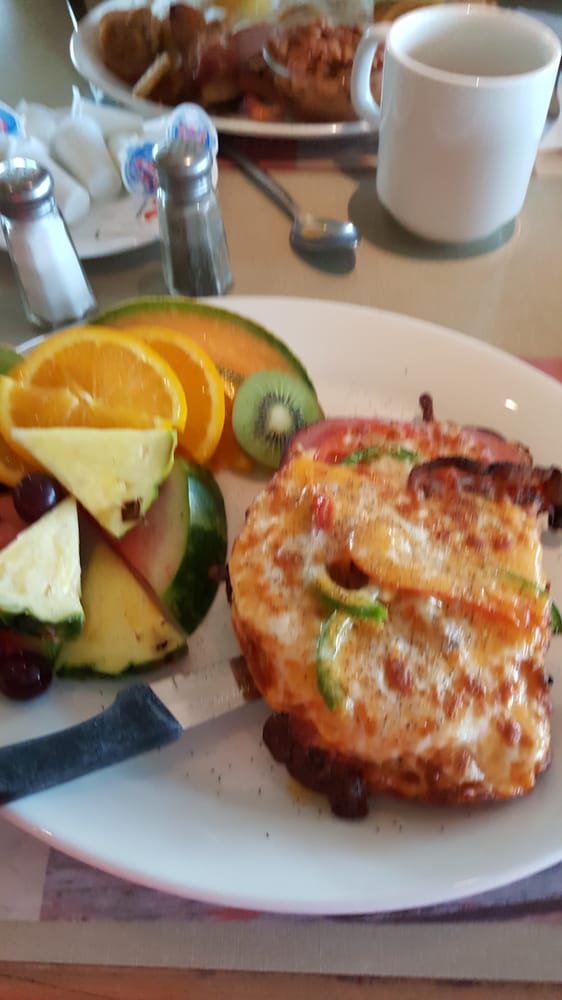
Find the location of a particular element. mug is located at coordinates (451, 154).